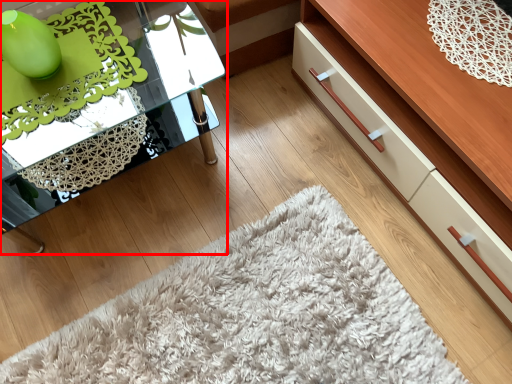
Question: From the image's perspective, what is the correct spatial positioning of table (annotated by the red box) in reference to dresser?

Choices:
 (A) below
 (B) above

Answer: (A)